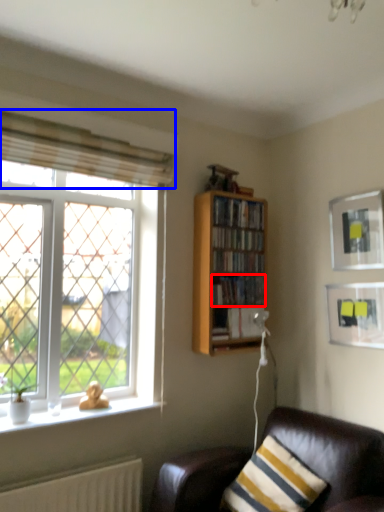
Question: Which object appears closest to the camera in this image, book (highlighted by a red box) or curtain (highlighted by a blue box)?

Choices:
 (A) book
 (B) curtain

Answer: (B)